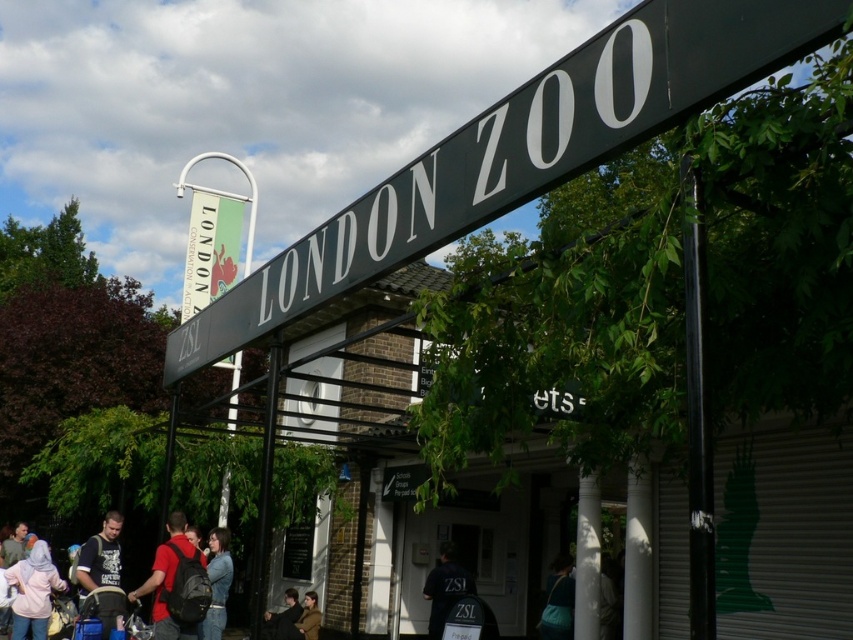
This screenshot has width=853, height=640. Describe the element at coordinates (445, 588) in the screenshot. I see `dark blue shirt at center` at that location.

Who is positioned more to the right, dark blue shirt at center or brown leather jacket at lower center?

From the viewer's perspective, dark blue shirt at center appears more on the right side.

Is point (448, 568) behind point (315, 628)?

No, it is not.

Locate an element on the screen. This screenshot has height=640, width=853. dark blue shirt at center is located at coordinates (445, 588).

Between black metal pole at right and matte red backpack at lower left, which one has less height?

Standing shorter between the two is matte red backpack at lower left.

Describe the element at coordinates (697, 419) in the screenshot. This screenshot has height=640, width=853. I see `black metal pole at right` at that location.

Locate an element on the screen. This screenshot has height=640, width=853. black metal pole at right is located at coordinates (697, 419).

What do you see at coordinates (697, 419) in the screenshot? I see `black metal pole at right` at bounding box center [697, 419].

Based on the photo, who is higher up, black metal pole at right or brown leather jacket at lower center?

black metal pole at right is higher up.

Which is in front, point (711, 532) or point (314, 596)?

Point (711, 532)

The height and width of the screenshot is (640, 853). Identify the location of black metal pole at right. (697, 419).